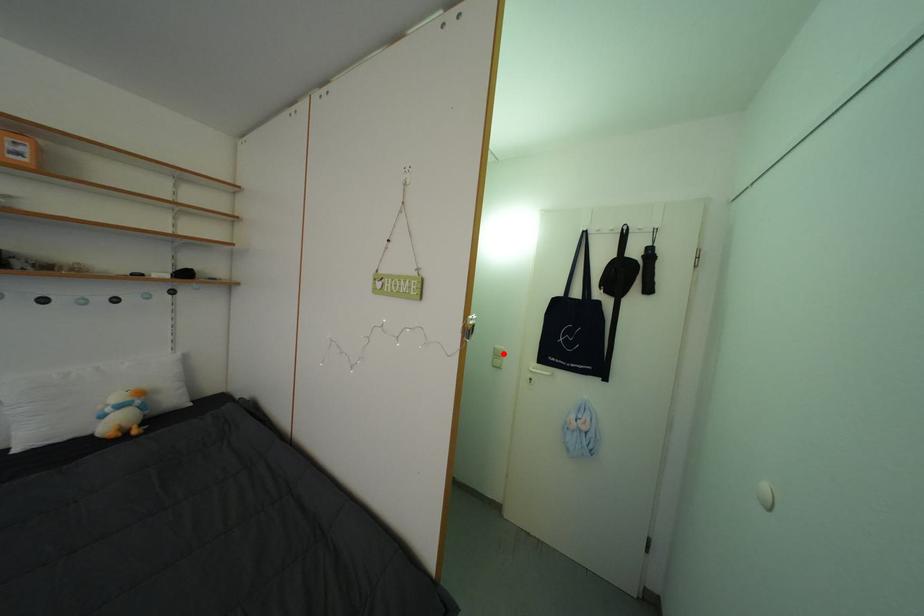
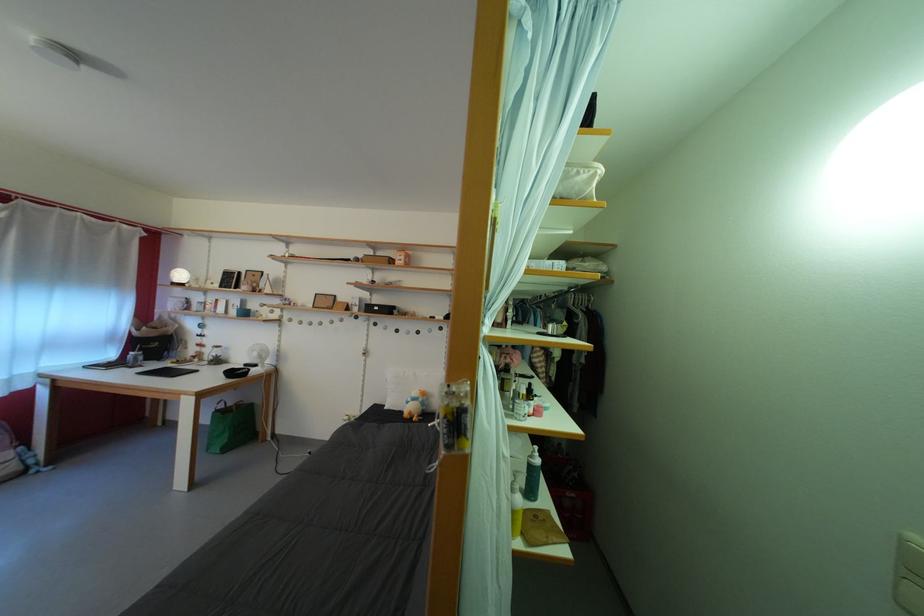
Find the pixel in the second image that matches the highlighted location in the first image.

(913, 545)